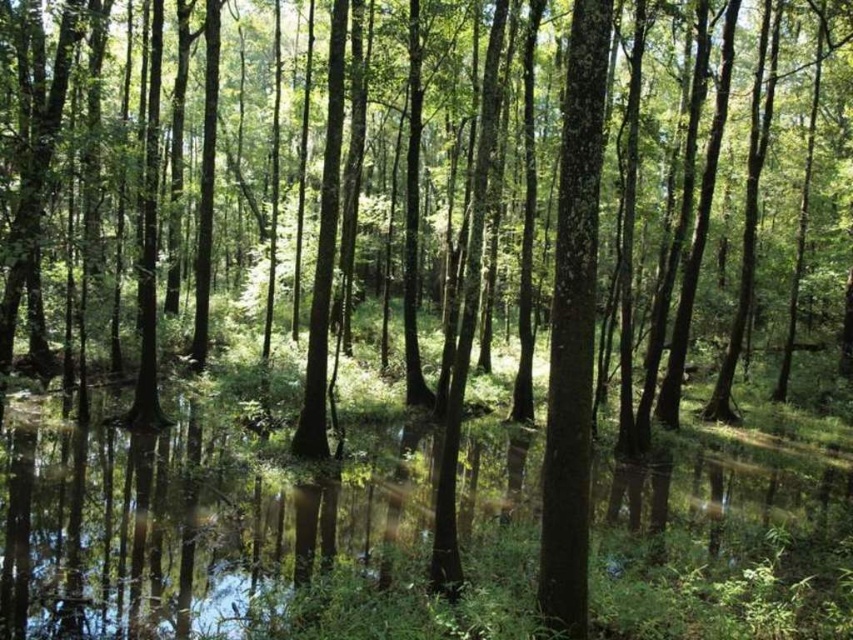
Question: Does smooth bark tree at center have a lesser width compared to clear water at center?

Choices:
 (A) no
 (B) yes

Answer: (A)

Question: Considering the relative positions of smooth bark tree at center and clear water at center in the image provided, where is smooth bark tree at center located with respect to clear water at center?

Choices:
 (A) right
 (B) left

Answer: (B)

Question: Does smooth bark tree at center have a lesser width compared to clear water at center?

Choices:
 (A) no
 (B) yes

Answer: (A)

Question: Which point is closer to the camera taking this photo?

Choices:
 (A) (743, 170)
 (B) (689, 465)

Answer: (B)

Question: Which of the following is the farthest from the observer?

Choices:
 (A) smooth bark tree at center
 (B) clear water at center

Answer: (A)